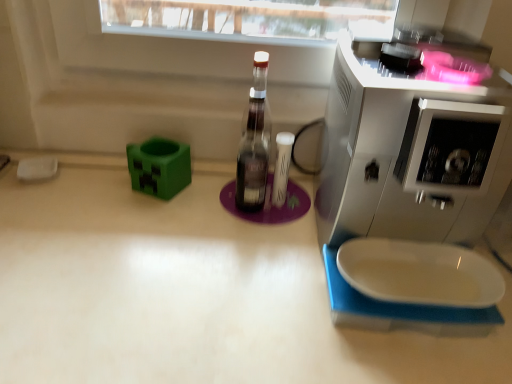
Describe the element at coordinates (188, 292) in the screenshot. I see `white matte countertop at center` at that location.

Where is `white matte countertop at center`? This screenshot has height=384, width=512. white matte countertop at center is located at coordinates (188, 292).

You are a GUI agent. You are given a task and a screenshot of the screen. Output one action in this format:
    pyautogui.click(x=<x>, y=<y>)
    Task: Click on the white glossy coffee machine at upper right
    
    Given the screenshot: What is the action you would take?
    pyautogui.click(x=412, y=148)

The image size is (512, 384). What do you see at coordinates (412, 148) in the screenshot? I see `white glossy coffee machine at upper right` at bounding box center [412, 148].

The image size is (512, 384). Identify the location of white matte countertop at center. (188, 292).

Does white matte countertop at center appear on the left side of white glossy coffee machine at upper right?

Indeed, white matte countertop at center is positioned on the left side of white glossy coffee machine at upper right.

Considering the positions of objects white matte countertop at center and white glossy coffee machine at upper right in the image provided, who is in front, white matte countertop at center or white glossy coffee machine at upper right?

Positioned in front is white glossy coffee machine at upper right.

Considering the points (181, 327) and (359, 164), which point is behind, point (181, 327) or point (359, 164)?

The point (181, 327) is behind.

From the image's perspective, is white matte countertop at center above white glossy coffee machine at upper right?

No.

From a real-world perspective, is white matte countertop at center positioned under white glossy coffee machine at upper right based on gravity?

Yes.

Does white matte countertop at center have a lesser width compared to white glossy coffee machine at upper right?

Incorrect, the width of white matte countertop at center is not less than that of white glossy coffee machine at upper right.

Can you confirm if white matte countertop at center is taller than white glossy coffee machine at upper right?

Correct, white matte countertop at center is much taller as white glossy coffee machine at upper right.

Who is bigger, white matte countertop at center or white glossy coffee machine at upper right?

white matte countertop at center.

Which is correct: white matte countertop at center is inside white glossy coffee machine at upper right, or outside of it?

white matte countertop at center lies outside white glossy coffee machine at upper right.

Is white matte countertop at center touching white glossy coffee machine at upper right?

There is a gap between white matte countertop at center and white glossy coffee machine at upper right.

Is white matte countertop at center positioned with its back to white glossy coffee machine at upper right?

No.

How much distance is there between white matte countertop at center and white glossy coffee machine at upper right?

white matte countertop at center and white glossy coffee machine at upper right are 9.24 inches apart.

Where is `countertop lying behind the white glossy coffee machine at upper right`? countertop lying behind the white glossy coffee machine at upper right is located at coordinates (188, 292).

Is white glossy coffee machine at upper right to the left of white matte countertop at center from the viewer's perspective?

No.

Between white glossy coffee machine at upper right and white matte countertop at center, which one is positioned in front?

Positioned in front is white glossy coffee machine at upper right.

Is point (358, 194) farther from viewer compared to point (25, 259)?

No, (358, 194) is closer to viewer.

From the image's perspective, between white glossy coffee machine at upper right and white matte countertop at center, which one is located above?

white glossy coffee machine at upper right is shown above in the image.

From a real-world perspective, relative to white matte countertop at center, is white glossy coffee machine at upper right vertically above or below?

white glossy coffee machine at upper right is situated higher than white matte countertop at center in the real world.

Does white glossy coffee machine at upper right have a greater width compared to white matte countertop at center?

No.

Which of these two, white glossy coffee machine at upper right or white matte countertop at center, stands shorter?

Standing shorter between the two is white glossy coffee machine at upper right.

Considering the sizes of white glossy coffee machine at upper right and white matte countertop at center in the image, is white glossy coffee machine at upper right bigger or smaller than white matte countertop at center?

Considering their sizes, white glossy coffee machine at upper right takes up less space than white matte countertop at center.

Is white matte countertop at center surrounded by white glossy coffee machine at upper right?

Actually, white matte countertop at center is outside white glossy coffee machine at upper right.

Is white glossy coffee machine at upper right positioned far away from white matte countertop at center?

No, white glossy coffee machine at upper right is not far away from white matte countertop at center.

Is white matte countertop at center at the back of white glossy coffee machine at upper right?

No, white glossy coffee machine at upper right is not facing away from white matte countertop at center.

What's the angular difference between white glossy coffee machine at upper right and white matte countertop at center's facing directions?

2.2e-05 degrees.

Measure the distance between white glossy coffee machine at upper right and white matte countertop at center.

white glossy coffee machine at upper right is 9.24 inches from white matte countertop at center.

The height and width of the screenshot is (384, 512). What are the coordinates of `home appliance above the white matte countertop at center (from a real-world perspective)` in the screenshot? It's located at (412, 148).

Find the location of `home appliance that appears on the right of white matte countertop at center`. home appliance that appears on the right of white matte countertop at center is located at coordinates (412, 148).

Find the location of a particular element. The image size is (512, 384). countertop behind the white glossy coffee machine at upper right is located at coordinates (188, 292).